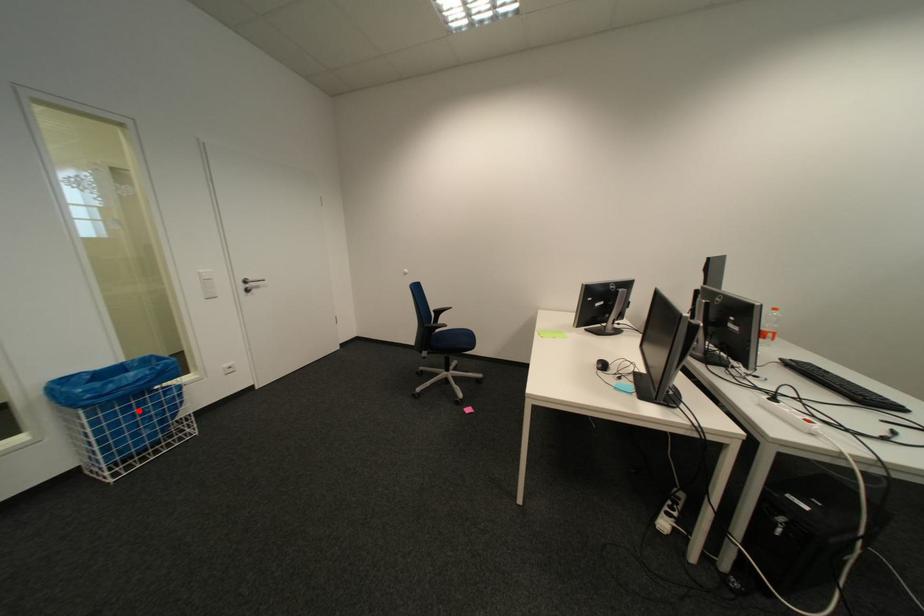
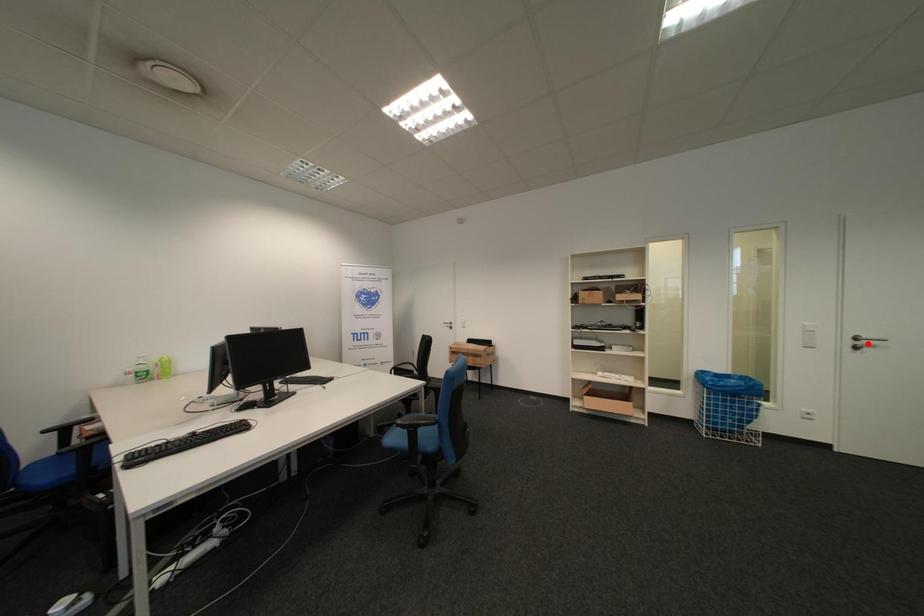
I am providing you with two images of the same scene from different viewpoints. A red point is marked on the first image and another point is marked on the second image. Does the point marked in image1 correspond to the same location as the one in image2?

No